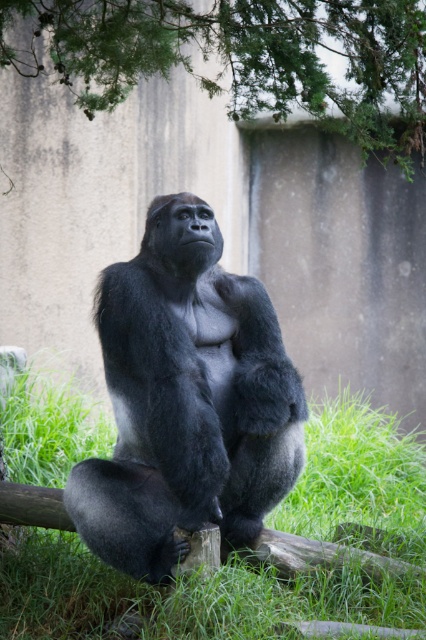
You are a photographer adjusting your camera settings to capture the scene with the two points marked in the image. Which point, point (163, 454) or point (180, 49), is closer to your camera lens?

Point (163, 454) is closer to the camera lens than point (180, 49).